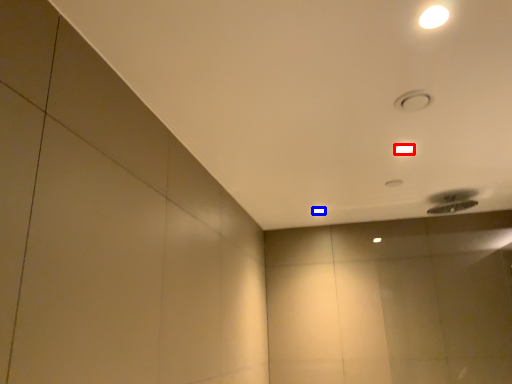
Question: Among these objects, which one is nearest to the camera, lamp (highlighted by a red box) or lamp (highlighted by a blue box)?

Choices:
 (A) lamp
 (B) lamp

Answer: (A)